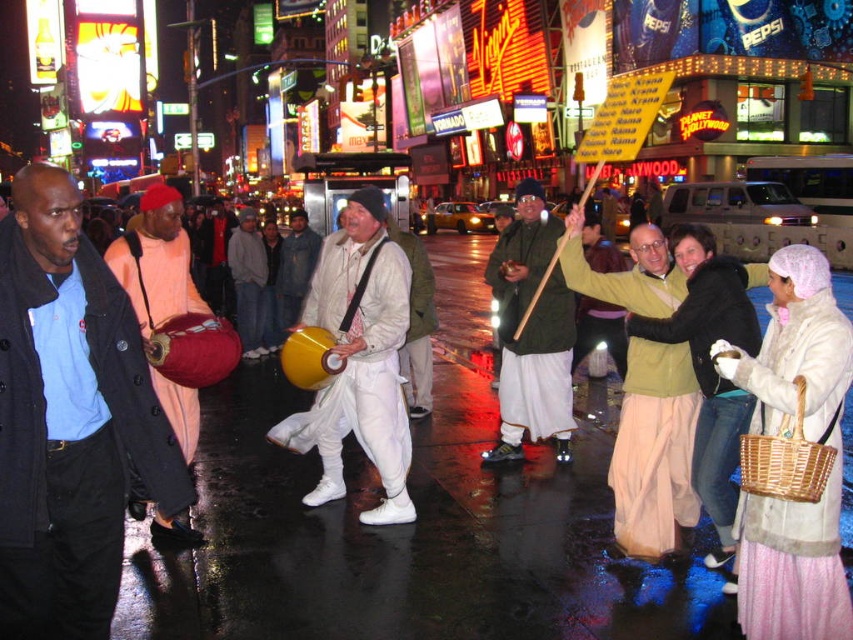
Does matte orange drum at left have a greater width compared to white cotton pants at center?

Correct, the width of matte orange drum at left exceeds that of white cotton pants at center.

Is matte orange drum at left shorter than white cotton pants at center?

No.

At what (x,y) coordinates should I click in order to perform the action: click on matte orange drum at left. Please return your answer as a coordinate pair (x, y). The image size is (853, 640). Looking at the image, I should click on (68, 419).

Between white cotton pants at center and matte peach drum at left, which one has more height?

matte peach drum at left

Can you confirm if white cotton pants at center is bigger than matte peach drum at left?

Actually, white cotton pants at center might be smaller than matte peach drum at left.

This screenshot has height=640, width=853. Find the location of `white cotton pants at center`. white cotton pants at center is located at coordinates 531,330.

Find the location of `white cotton pants at center`. white cotton pants at center is located at coordinates (531, 330).

Is matte yellow drum at center above white cotton pants at center?

Actually, matte yellow drum at center is below white cotton pants at center.

At what (x,y) coordinates should I click in order to perform the action: click on matte yellow drum at center. Please return your answer as a coordinate pair (x, y). Image resolution: width=853 pixels, height=640 pixels. Looking at the image, I should click on (358, 358).